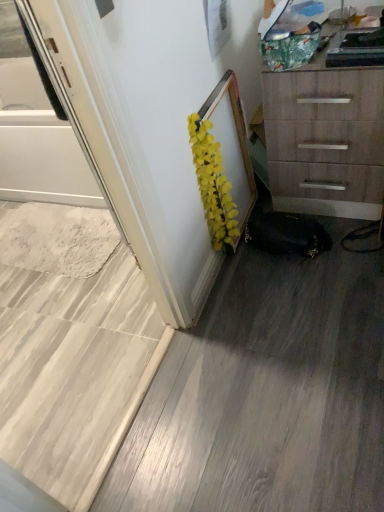
Question: Do you think white glossy screen door at left is within yellow artificial flowers at center, or outside of it?

Choices:
 (A) outside
 (B) inside

Answer: (A)

Question: Considering the positions of white glossy screen door at left and yellow artificial flowers at center in the image, is white glossy screen door at left wider or thinner than yellow artificial flowers at center?

Choices:
 (A) wide
 (B) thin

Answer: (A)

Question: Estimate the real-world distances between objects in this image. Which object is farther from the yellow artificial flowers at center?

Choices:
 (A) white glossy screen door at left
 (B) wooden chest of drawers at upper right

Answer: (A)

Question: Which is farther from the white glossy screen door at left?

Choices:
 (A) yellow artificial flowers at center
 (B) wooden chest of drawers at upper right

Answer: (B)